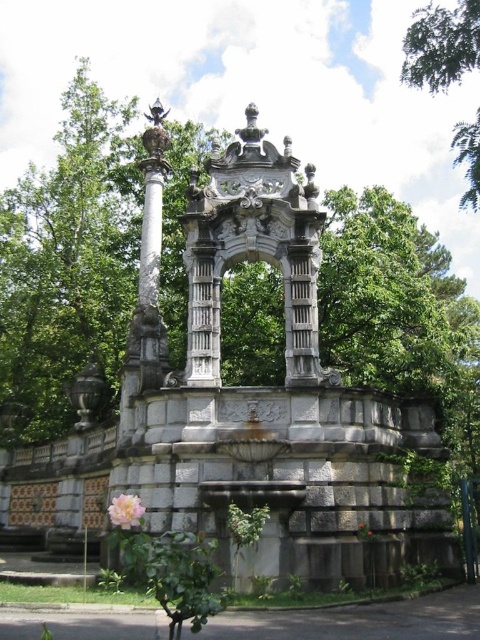
Question: Can you confirm if carved stone arch at center is positioned below green leafy tree at upper right?

Choices:
 (A) yes
 (B) no

Answer: (A)

Question: Observing the image, what is the correct spatial positioning of gray stone fountain at center in reference to pink matte flower at lower left?

Choices:
 (A) below
 (B) above

Answer: (B)

Question: Which object is positioned closest to the green leafy tree at upper right?

Choices:
 (A) carved stone arch at center
 (B) pink matte flower at lower left

Answer: (A)

Question: Among these points, which one is nearest to the camera?

Choices:
 (A) (123, 500)
 (B) (260, 412)
 (C) (228, 154)
 (D) (459, 10)

Answer: (A)

Question: Which object appears farthest from the camera in this image?

Choices:
 (A) gray stone fountain at center
 (B) green leafy tree at upper right

Answer: (B)

Question: Is gray stone fountain at center above carved stone arch at center?

Choices:
 (A) yes
 (B) no

Answer: (B)